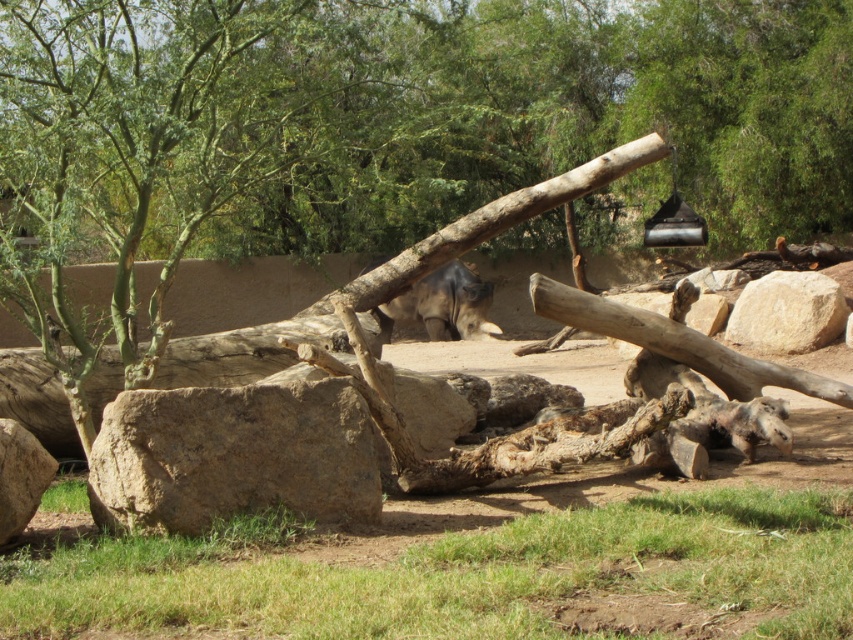
You are a zookeeper planning to place a new feeding trough for the rhinoceros. The trough requires a flat, elevated surface to prevent it from sinking into the ground. Based on the scene, which rock should you choose between the brown rough rock at lower left and the beige rough rock at right?

The beige rough rock at right is higher than the brown rough rock at lower left, so the beige rough rock at right provides a better elevated surface for the feeding trough.

You are a zookeeper who needs to place a 10 feet wide feeding trough between the brown rough rock at lower left and the beige rough rock at right. Can you fit it without moving either rock?

The distance between the brown rough rock at lower left and the beige rough rock at right is 35.63 feet. Since the feeding trough is only 10 feet wide, there is ample space to place it between them without moving either rock.